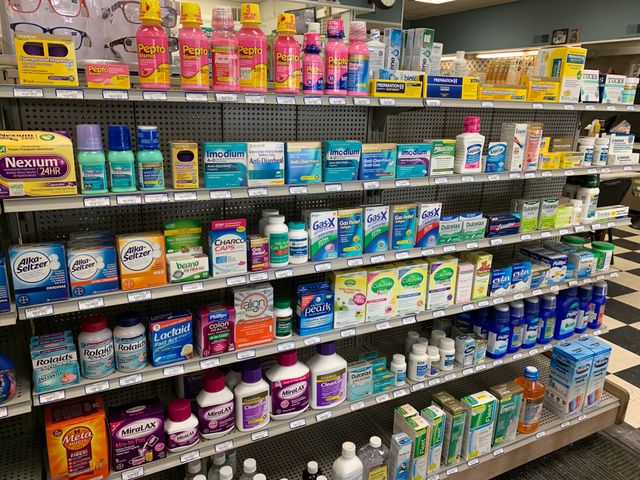
Locate an element on the screen. black and white checkered floor is located at coordinates (619, 354), (626, 335).